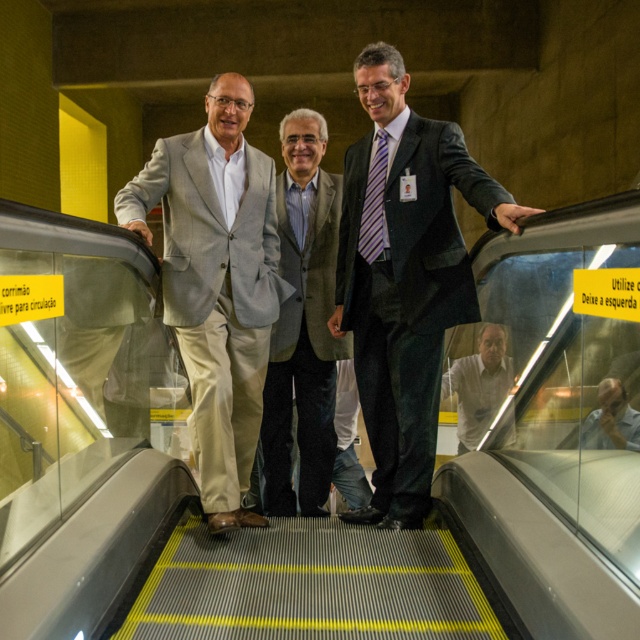
From the picture: You are a fashion designer observing two men on an escalator in a subway station. You notice the dark gray suit at center and the light gray suit at center. Which suit appears larger in size?

The dark gray suit at center is bigger than the light gray suit at center, so the dark gray suit at center appears larger in size.

You are a photographer standing in front of the escalator. You need to take a photo of the dark gray suit at center and the white glossy shirt at center. Which one should you adjust your camera focus to first if you want to capture both clearly in the same frame?

The dark gray suit at center is to the left of white glossy shirt at center. Since they are positioned side by side, you can adjust your camera focus on either one first as they are both at the same distance from the camera. However, focusing on the dark gray suit at center first might help ensure the subject on the left is sharp, then recompose to include the white glossy shirt at center.